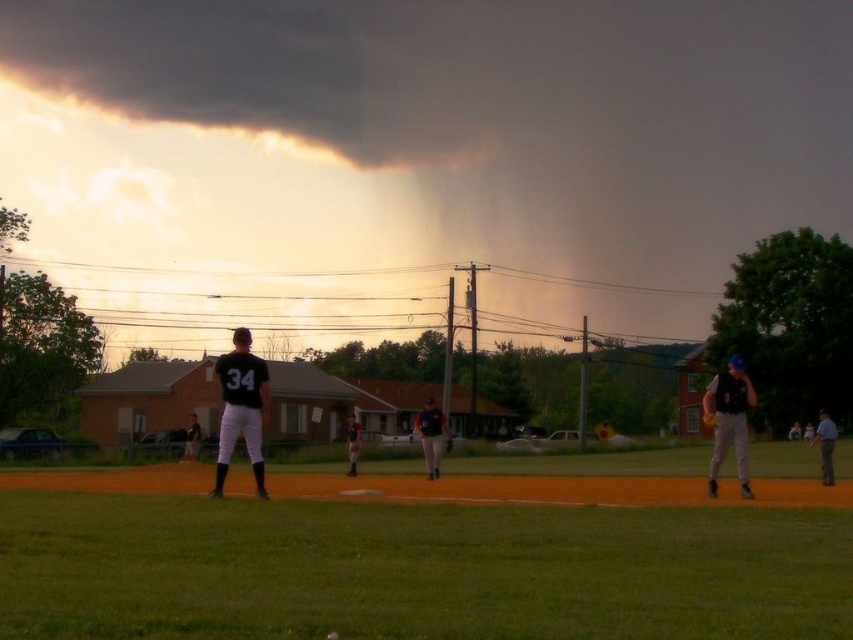
You are a photographer trying to capture a closeup shot of the matte black vest at right and the gray uniform at right. Since your camera can only focus on one object at a time, which object should you choose to ensure the entire width of the object is in focus?

The matte black vest at right has a lesser width compared to gray uniform at right, so you should choose the matte black vest at right to ensure the entire width fits in focus since it is narrower.

You are a photographer positioned at the center of the baseball field. You want to take a photo that includes both the matte black vest at right and the gray uniform at right. Which object should you adjust your camera angle upwards to include in the frame?

You should adjust your camera angle upwards to include the gray uniform at right because the matte black vest at right has a lesser height compared to gray uniform at right.

You are a photographer standing at the edge of the baseball field. You want to take a closeup shot of the matte black baseball glove at center. The camera you are using has a maximum zoom range of 25 meters. Can you capture the glove clearly without moving closer?

The distance between the matte black baseball glove at center and the camera is 25.13 meters. Since the camera can only zoom up to 25 meters, you cannot capture the glove clearly without moving closer because the distance exceeds the maximum zoom range by 0.13 meters.